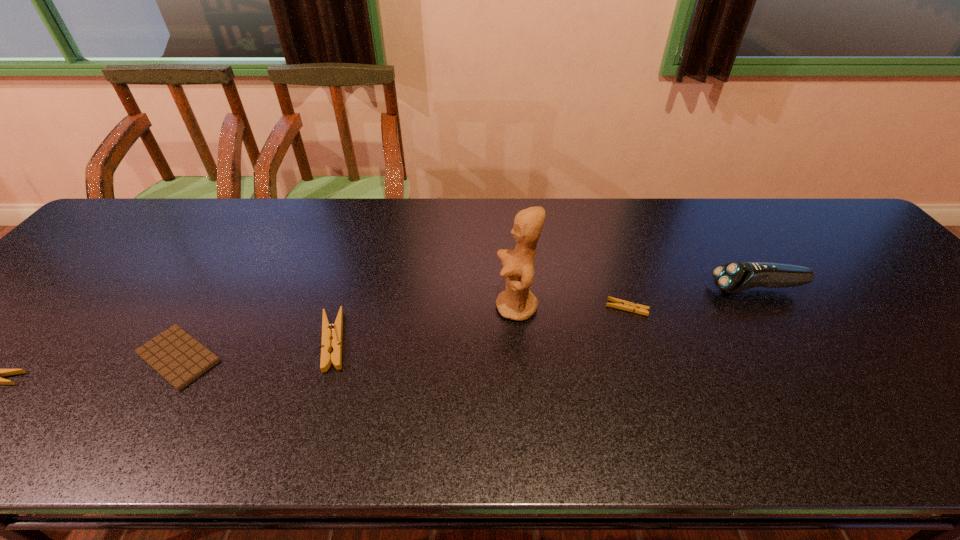
The image size is (960, 540). In order to click on the second clothespin from right to left in this screenshot , I will do `click(329, 331)`.

The width and height of the screenshot is (960, 540). Identify the location of the tallest clothespin. (329, 331).

Find the location of a particular element. The width and height of the screenshot is (960, 540). the rightmost clothespin is located at coordinates 618,303.

Locate an element on the screen. the shortest clothespin is located at coordinates (618, 303).

Where is `chocolate bar`? The width and height of the screenshot is (960, 540). chocolate bar is located at coordinates (179, 358).

I want to click on the shortest object, so click(179, 358).

Identify the location of figurine. (516, 302).

Where is `the third object from right to left`? the third object from right to left is located at coordinates (516, 302).

This screenshot has width=960, height=540. I want to click on electric shaver, so [736, 277].

This screenshot has height=540, width=960. Identify the location of the rightmost object. (736, 277).